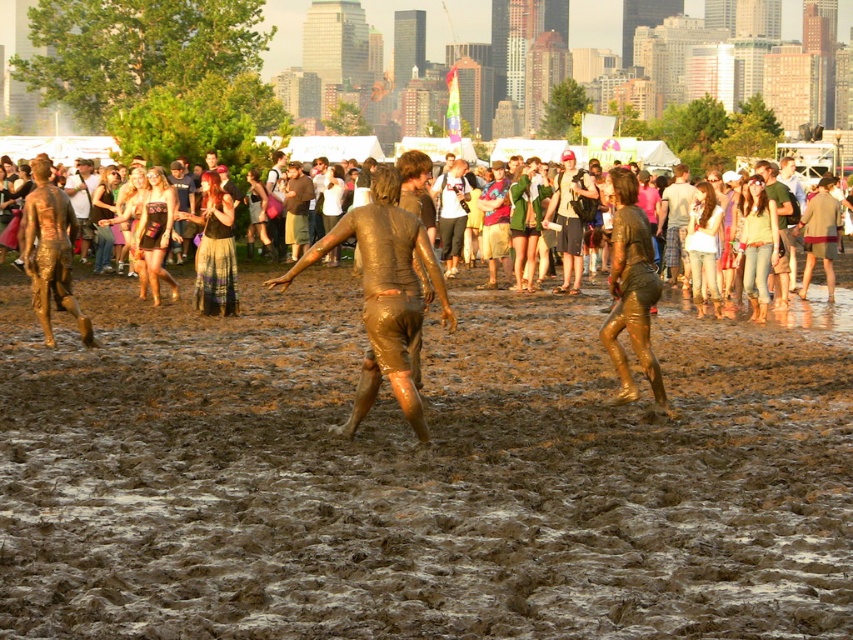
You are a participant in the mud run event and need to reach the finish line located at the edge of the image. You see the gold shiny mud at center. Based on its position, can you determine if it is directly in your path towards the finish line?

The gold shiny mud at center is located at coordinates point (631, 291). Since the finish line is at the edge of the image, the exact position of the gold shiny mud at center would determine if it is directly in your path. However, without additional spatial context about the finish line location, it is impossible to confirm if it obstructs your path.

You are a participant in the mud run event and want to avoid stepping on the matte brown mud at left. Which direction should you move relative to the muddy wet ground at center to stay clear of it?

The muddy wet ground at center is located below the matte brown mud at left, so to avoid stepping on the matte brown mud at left, you should move downward away from the matte brown mud at left towards the muddy wet ground at center.